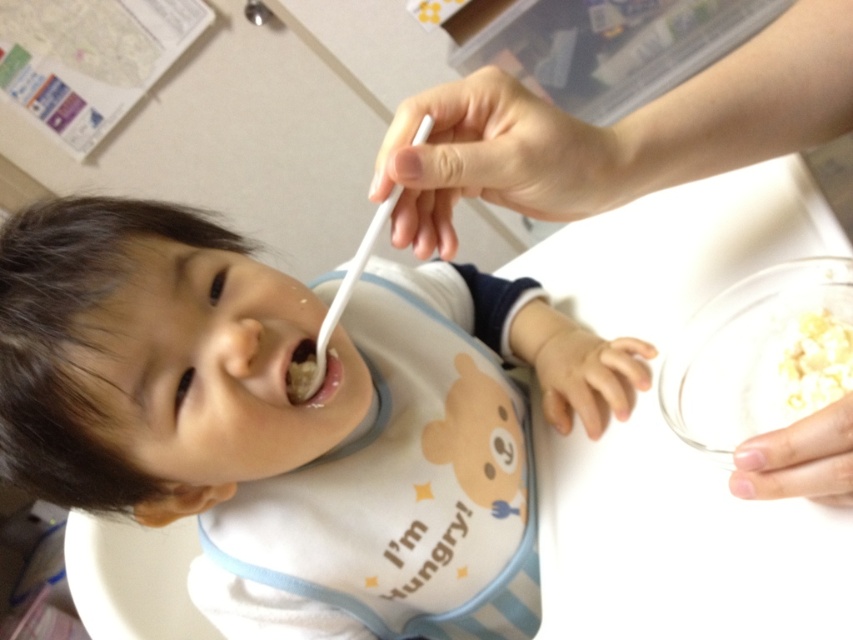
Does white plastic spoon at upper center appear over white matte cereal at upper right?

No, white plastic spoon at upper center is not above white matte cereal at upper right.

Can you confirm if white plastic spoon at upper center is thinner than white matte cereal at upper right?

No, white plastic spoon at upper center is not thinner than white matte cereal at upper right.

Between point (387, 627) and point (805, 326), which one is positioned behind?

The point (387, 627) is behind.

What are the coordinates of `white plastic spoon at upper center` in the screenshot? It's located at (293, 419).

Can you confirm if white plastic spoon at mouth is thinner than white matte food at center?

No.

Is the position of white plastic spoon at mouth more distant than that of white matte food at center?

No, white plastic spoon at mouth is in front of white matte food at center.

Between point (335, 307) and point (318, 371), which one is positioned behind?

Positioned behind is point (318, 371).

Where is `white plastic spoon at mouth`? The width and height of the screenshot is (853, 640). white plastic spoon at mouth is located at coordinates click(347, 289).

Looking at this image, does white matte cereal at upper right have a smaller size compared to white matte food at center?

Incorrect, white matte cereal at upper right is not smaller in size than white matte food at center.

Is point (837, 340) closer to viewer compared to point (326, 352)?

Yes, point (837, 340) is in front of point (326, 352).

Find the location of a particular element. Image resolution: width=853 pixels, height=640 pixels. white matte cereal at upper right is located at coordinates (814, 362).

Where is `white matte cereal at upper right`? white matte cereal at upper right is located at coordinates (814, 362).